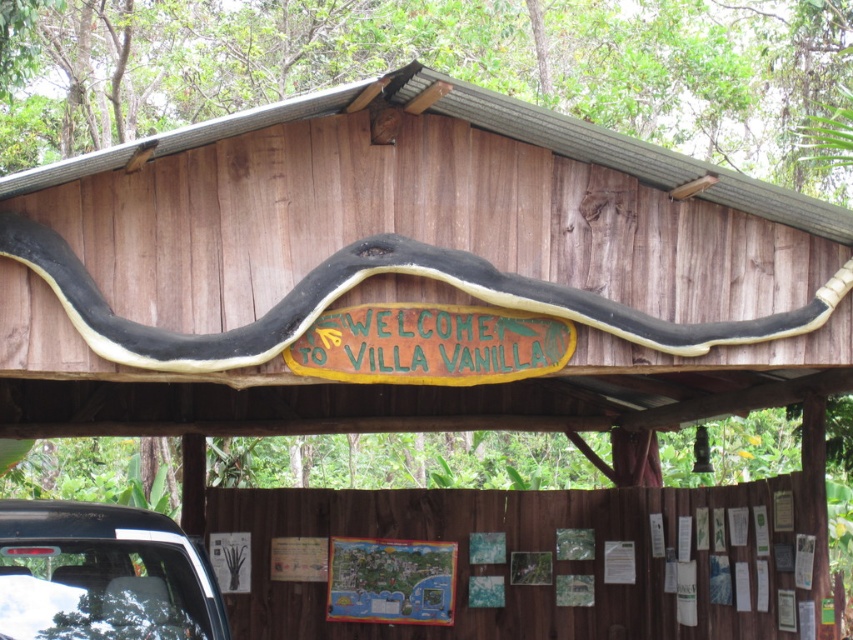
Question: Is black rubber snake at center to the left of white glossy car at lower left from the viewer's perspective?

Choices:
 (A) no
 (B) yes

Answer: (A)

Question: Among these objects, which one is farthest from the camera?

Choices:
 (A) white glossy car at lower left
 (B) black rubber snake at center

Answer: (B)

Question: Which object appears closest to the camera in this image?

Choices:
 (A) black rubber snake at center
 (B) white glossy car at lower left

Answer: (B)

Question: Is black rubber snake at center positioned before white glossy car at lower left?

Choices:
 (A) yes
 (B) no

Answer: (B)

Question: Is black rubber snake at center below white glossy car at lower left?

Choices:
 (A) no
 (B) yes

Answer: (A)